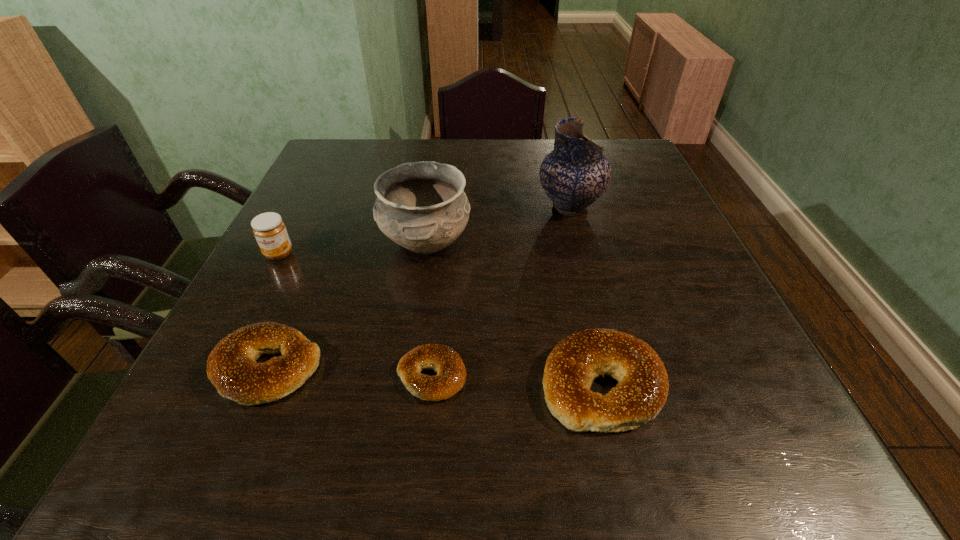
The height and width of the screenshot is (540, 960). I want to click on unoccupied area between the shortest object and the leftmost bagel, so click(x=349, y=372).

At what (x,y) coordinates should I click in order to perform the action: click on vacant area that lies between the rightmost bagel and the jam. Please return your answer as a coordinate pair (x, y). This screenshot has width=960, height=540. Looking at the image, I should click on (441, 319).

I want to click on vacant area between the leftmost bagel and the rightmost bagel, so click(x=435, y=376).

Identify the location of vacant area that lies between the second bagel from left to right and the third tallest object. Image resolution: width=960 pixels, height=540 pixels. (355, 315).

Point out which object is positioned as the fifth nearest to the rightmost bagel. Please provide its 2D coordinates. Your answer should be formatted as a tuple, i.e. [(x, y)], where the tuple contains the x and y coordinates of a point satisfying the conditions above.

[(269, 229)]

The width and height of the screenshot is (960, 540). I want to click on the second closest object relative to the fifth shortest object, so click(231, 366).

Identify which bagel is the nearest to the jam. Please provide its 2D coordinates. Your answer should be formatted as a tuple, i.e. [(x, y)], where the tuple contains the x and y coordinates of a point satisfying the conditions above.

[(231, 366)]

Identify the location of bagel identified as the closest to the shortest object. The image size is (960, 540). (576, 361).

Where is `vacant point that satisfies the following two spatial constraints: 1. on the front label of the second bagel from right to left; 2. on the left side of the jam`? The image size is (960, 540). vacant point that satisfies the following two spatial constraints: 1. on the front label of the second bagel from right to left; 2. on the left side of the jam is located at coordinates (216, 376).

The image size is (960, 540). I want to click on free point that satisfies the following two spatial constraints: 1. on the back side of the tallest object; 2. on the left side of the left pottery, so click(431, 207).